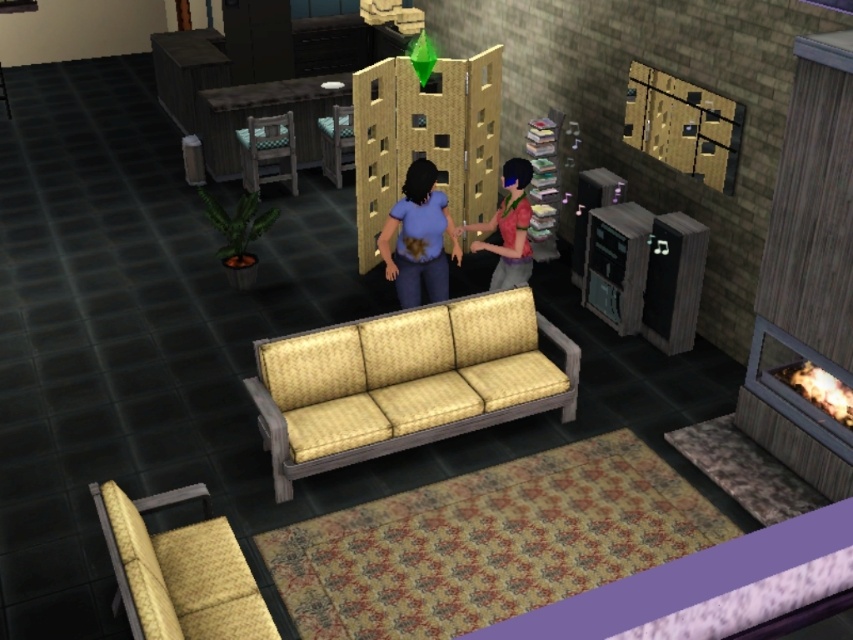
Question: Can you confirm if matte yellow fabric chair at lower left is positioned above wooden chair at center?

Choices:
 (A) no
 (B) yes

Answer: (A)

Question: Which of the following is the closest to the observer?

Choices:
 (A) (398, 291)
 (B) (466, 224)
 (C) (271, 144)
 (D) (338, 170)

Answer: (A)

Question: Can you confirm if matte blue shirt at center is positioned to the left of matte pink shirt at center?

Choices:
 (A) no
 (B) yes

Answer: (B)

Question: Which point is closer to the camera taking this photo?

Choices:
 (A) (238, 144)
 (B) (199, 636)

Answer: (B)

Question: Which point appears closest to the camera in this image?

Choices:
 (A) (300, 134)
 (B) (514, 243)
 (C) (410, 304)

Answer: (B)

Question: Does yellow textured couch at center come in front of wooden chair at center?

Choices:
 (A) yes
 (B) no

Answer: (A)